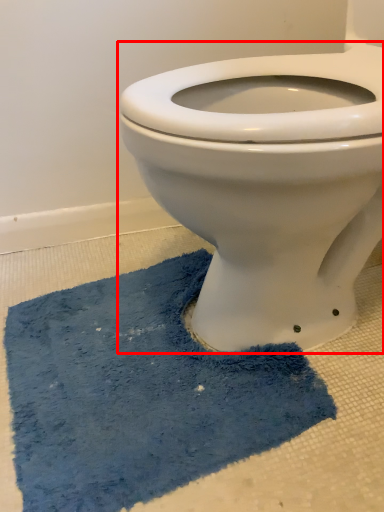
Question: From the image's perspective, where is toilet (annotated by the red box) located in relation to bath mat in the image?

Choices:
 (A) above
 (B) below

Answer: (A)